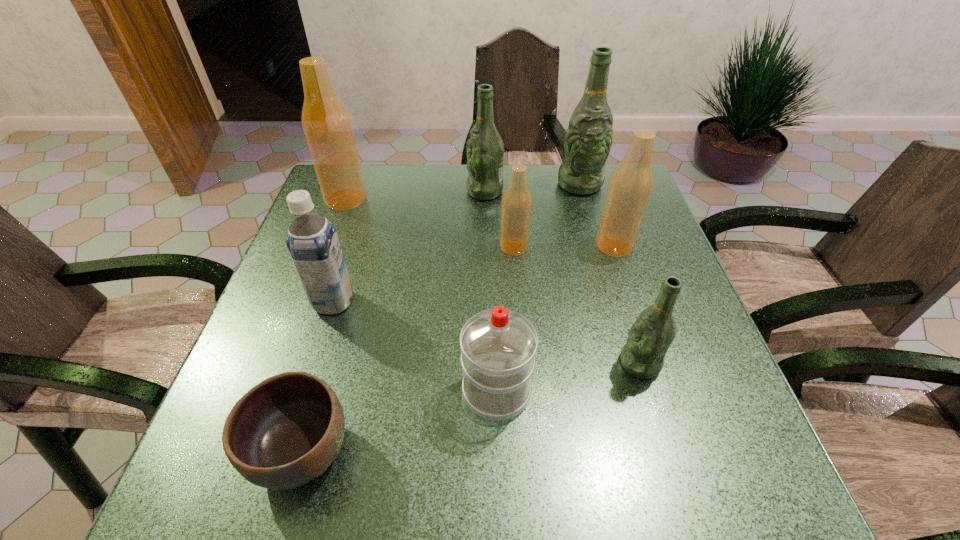
This screenshot has width=960, height=540. In order to click on beer bottle that is the closest one to the rightmost tan beer bottle in this screenshot , I will do `click(588, 139)`.

The height and width of the screenshot is (540, 960). In order to click on the closest green beer bottle to the biggest tan beer bottle in this screenshot , I will do `click(485, 150)`.

Locate an element on the screen. The width and height of the screenshot is (960, 540). the second closest green beer bottle to the biggest green beer bottle is located at coordinates (x=651, y=335).

Select which tan beer bottle is the second closest to the second biggest tan beer bottle. Please provide its 2D coordinates. Your answer should be formatted as a tuple, i.e. [(x, y)], where the tuple contains the x and y coordinates of a point satisfying the conditions above.

[(326, 123)]

This screenshot has height=540, width=960. I want to click on the second closest tan beer bottle to the sixth farthest object, so click(x=516, y=204).

Where is `vacant position in the image that satisfies the following two spatial constraints: 1. on the handle side of the water bottle; 2. on the surface of the second smallest green beer bottle`? vacant position in the image that satisfies the following two spatial constraints: 1. on the handle side of the water bottle; 2. on the surface of the second smallest green beer bottle is located at coordinates (491, 191).

Locate an element on the screen. The height and width of the screenshot is (540, 960). free spot that satisfies the following two spatial constraints: 1. on the surface of the leftmost green beer bottle; 2. on the right side of the smallest tan beer bottle is located at coordinates (486, 247).

Locate an element on the screen. The height and width of the screenshot is (540, 960). free location that satisfies the following two spatial constraints: 1. on the surface of the biggest green beer bottle; 2. on the left side of the second biggest tan beer bottle is located at coordinates (597, 245).

Image resolution: width=960 pixels, height=540 pixels. I want to click on free space that satisfies the following two spatial constraints: 1. on the handle side of the water bottle; 2. on the left side of the second smallest tan beer bottle, so [492, 245].